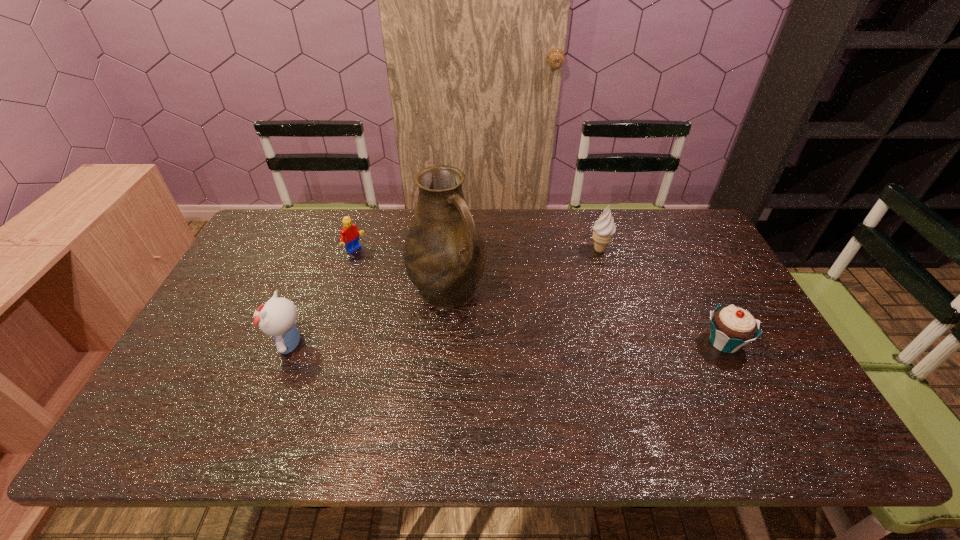
I want to click on free space on the desktop that is between the kitten and the rightmost object and is positioned on the front-facing side of the fourth object from left to right, so click(x=553, y=343).

Where is `vacant space on the desktop that is between the leftmost object and the cupcake and is positioned on the front-facing side of the second object from left to right`? vacant space on the desktop that is between the leftmost object and the cupcake and is positioned on the front-facing side of the second object from left to right is located at coordinates (490, 343).

The image size is (960, 540). In order to click on vacant spot on the desktop that is between the kitten and the cupcake and is positioned on the handle side of the pitcher in this screenshot , I will do `click(499, 343)`.